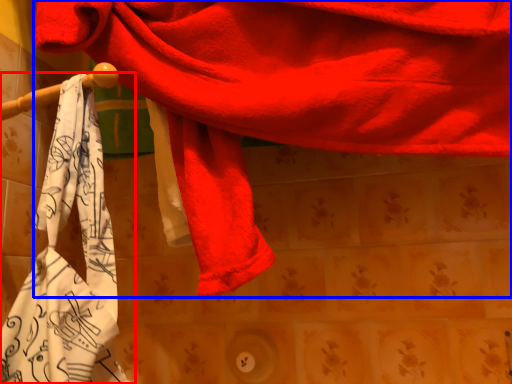
Question: Which object is further to the camera taking this photo, towel (highlighted by a red box) or towel (highlighted by a blue box)?

Choices:
 (A) towel
 (B) towel

Answer: (A)